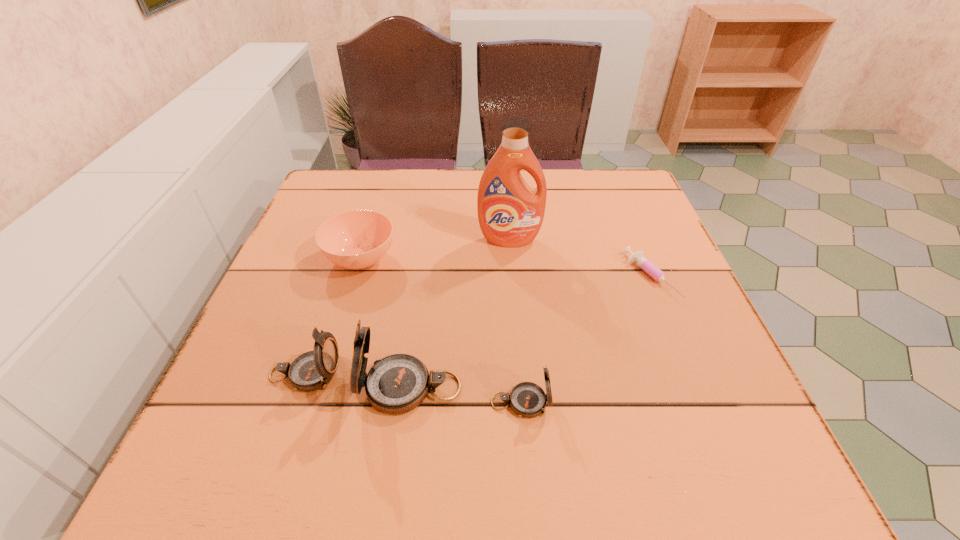
Where is `the leftmost compass`? the leftmost compass is located at coordinates (312, 370).

The width and height of the screenshot is (960, 540). Identify the location of the second shortest compass. (312, 370).

Where is `the second tallest object`? Image resolution: width=960 pixels, height=540 pixels. the second tallest object is located at coordinates (398, 383).

Where is `the tallest compass`? the tallest compass is located at coordinates tap(398, 383).

Where is `the shortest compass`? The width and height of the screenshot is (960, 540). the shortest compass is located at coordinates (527, 399).

This screenshot has width=960, height=540. Identify the location of detergent. (510, 213).

Locate an element on the screen. This screenshot has width=960, height=540. the second shortest object is located at coordinates pyautogui.click(x=358, y=239).

You are a GUI agent. You are given a task and a screenshot of the screen. Output one action in this format:
    pyautogui.click(x=<x>, y=<y>)
    Task: Click on the syringe
    The width and height of the screenshot is (960, 540).
    Given the screenshot: What is the action you would take?
    pyautogui.click(x=653, y=271)

Locate an element on the screen. the rightmost object is located at coordinates (653, 271).

This screenshot has height=540, width=960. What are the coordinates of `vacant area situated 0.370m on the face of the leftmost compass` in the screenshot? It's located at (551, 374).